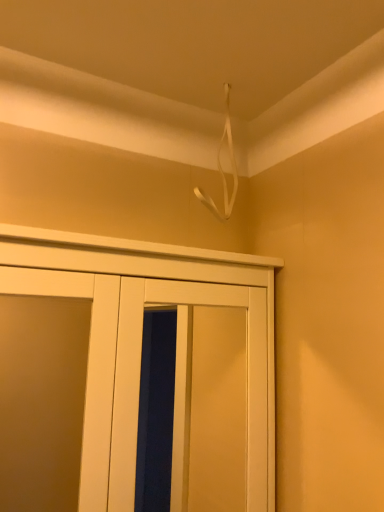
Describe the element at coordinates (151, 275) in the screenshot. The height and width of the screenshot is (512, 384). I see `white glossy cupboard at center` at that location.

Locate an element on the screen. white glossy cupboard at center is located at coordinates coord(151,275).

Find the location of a particular element. This screenshot has width=384, height=512. white glossy cupboard at center is located at coordinates (151, 275).